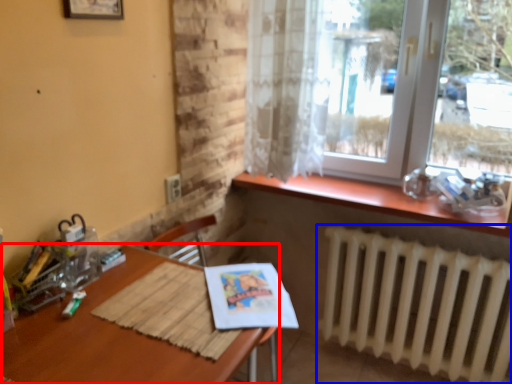
Question: Among these objects, which one is farthest to the camera, table (highlighted by a red box) or radiator (highlighted by a blue box)?

Choices:
 (A) table
 (B) radiator

Answer: (B)